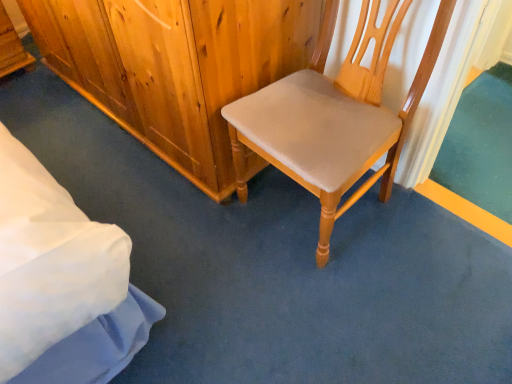
Find the location of a particular element. This screenshot has width=512, height=384. vacant space in front of light brown wood chair at center is located at coordinates (336, 302).